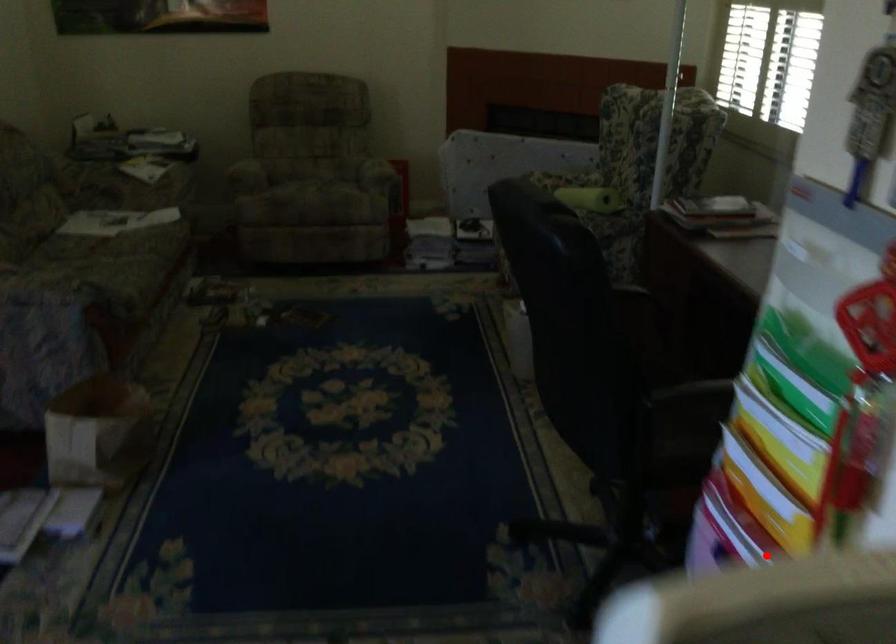
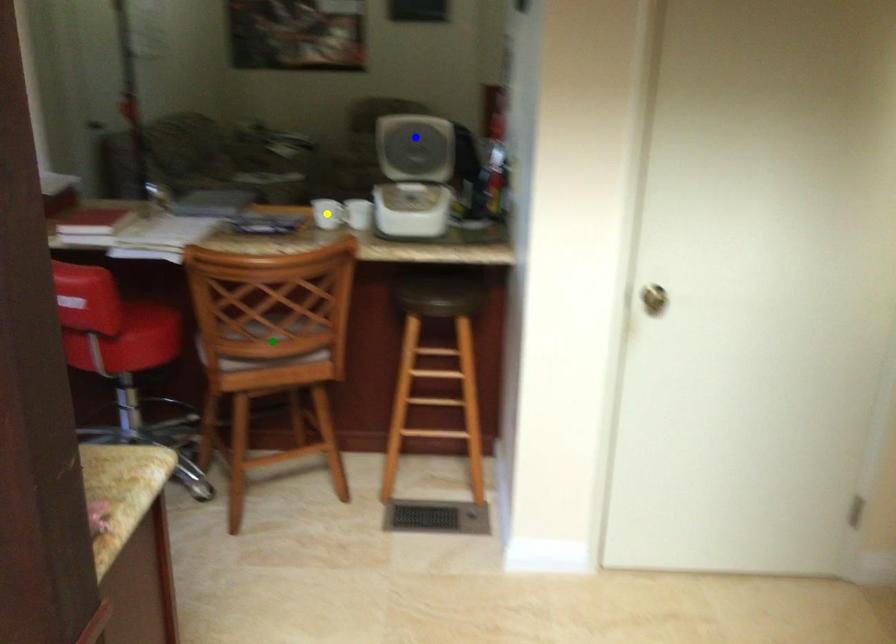
Question: I am providing you with two images of the same scene from different viewpoints. A red point is marked on the first image. You are given multiple points on the second image. In image 2, which mark is for the same physical point as the one in image 1?

Choices:
 (A) yellow point
 (B) green point
 (C) blue point

Answer: (C)